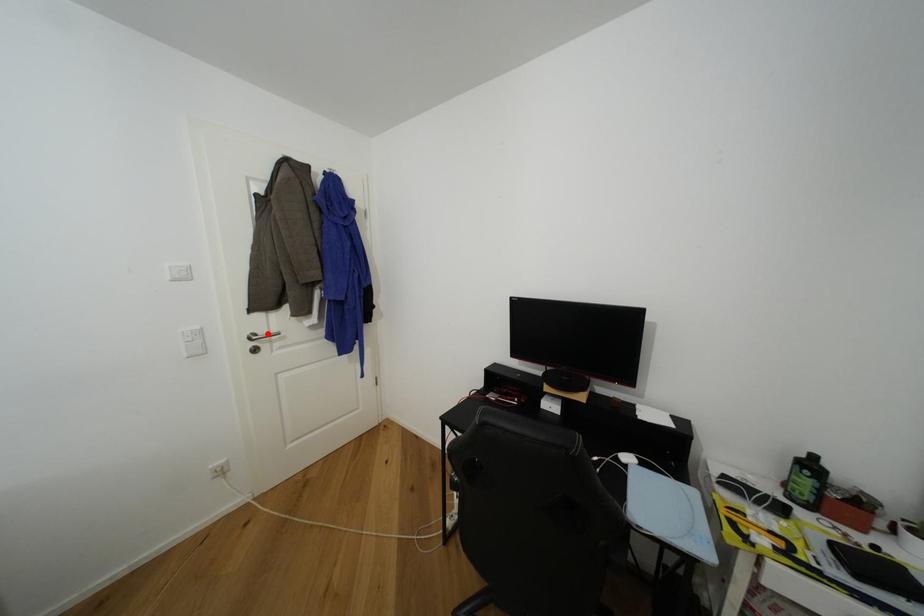
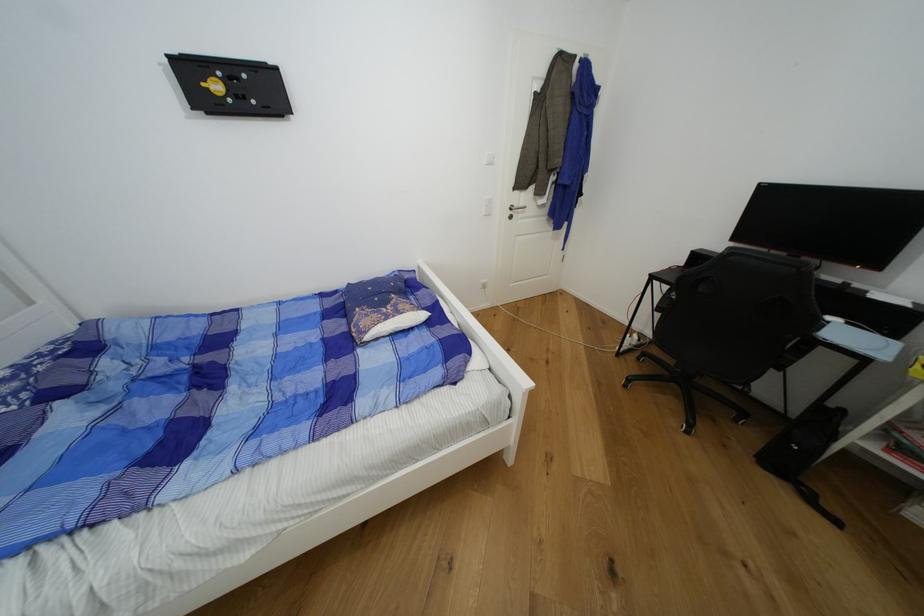
The point at the highlighted location is marked in the first image. Where is the corresponding point in the second image?

(521, 207)